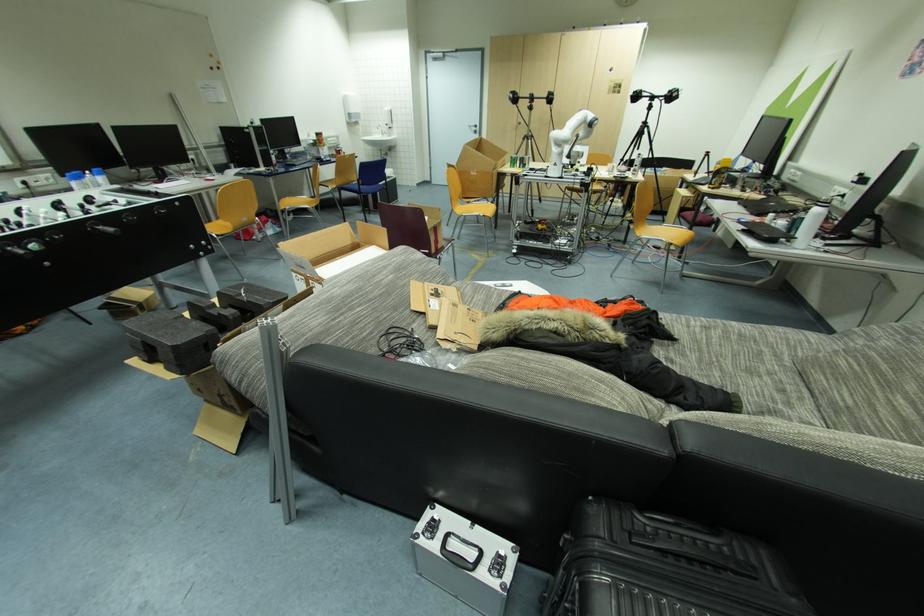
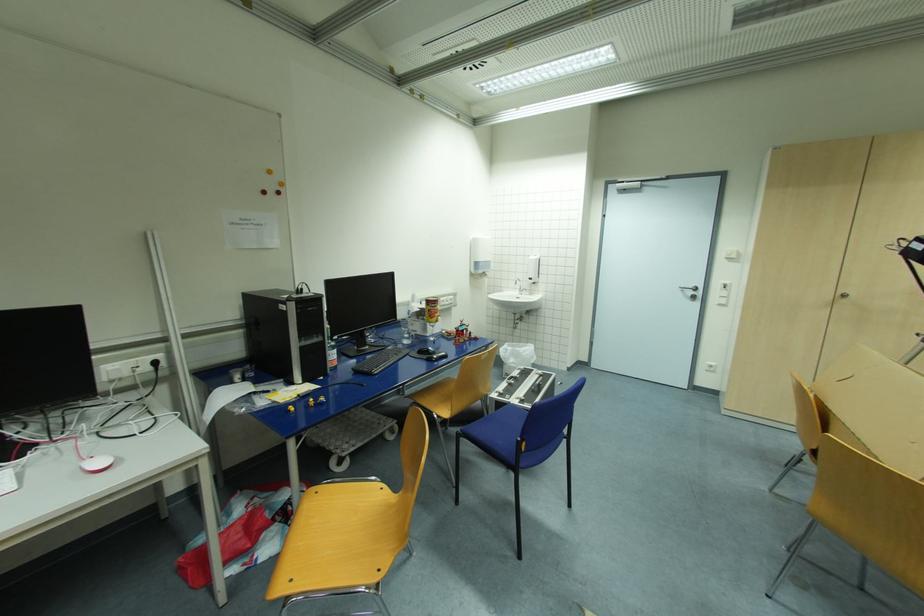
In the second image, find the point that corresponds to pixel 390 126 in the first image.

(533, 280)